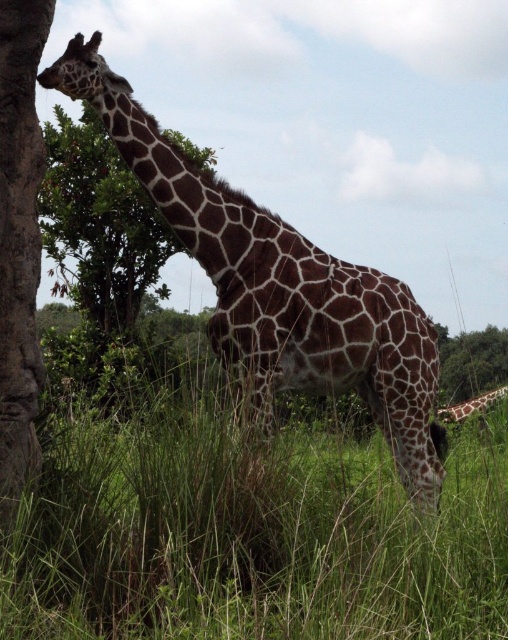
You are a photographer standing in the savanna and want to take a photo of the brown spotted giraffe at center and the brown rough tree trunk at left. Which object is closer to you, the photographer?

The brown spotted giraffe at center is closer to you because it is positioned further to the viewer than the brown rough tree trunk at left.

You are a wildlife photographer aiming to capture a closeup shot of the brown spotted giraffe at right while also including the green leafy tree at upper left in the background. Given that your camera has a depth of field that can sharply focus on objects within a 10 feet range, will both the giraffe and the tree be in focus?

The distance between the green leafy tree at upper left and brown spotted giraffe at right is 12.68 feet. Since the depth of field can only sharply focus within 10 feet, the 12.68 feet separation means both cannot be in focus simultaneously.

Based on the photo, you are a wildlife photographer carrying a camera bag that is 1.5 meters long. You are positioned near the brown rough tree trunk at left and want to move to the brown spotted giraffe at center to take a photo. Can your camera bag fit horizontally between the two without hitting either?

The distance between the brown spotted giraffe at center and the brown rough tree trunk at left is 1.73 meters. Since your camera bag is 1.5 meters long, it can fit horizontally between them as the distance is greater than the bag length.